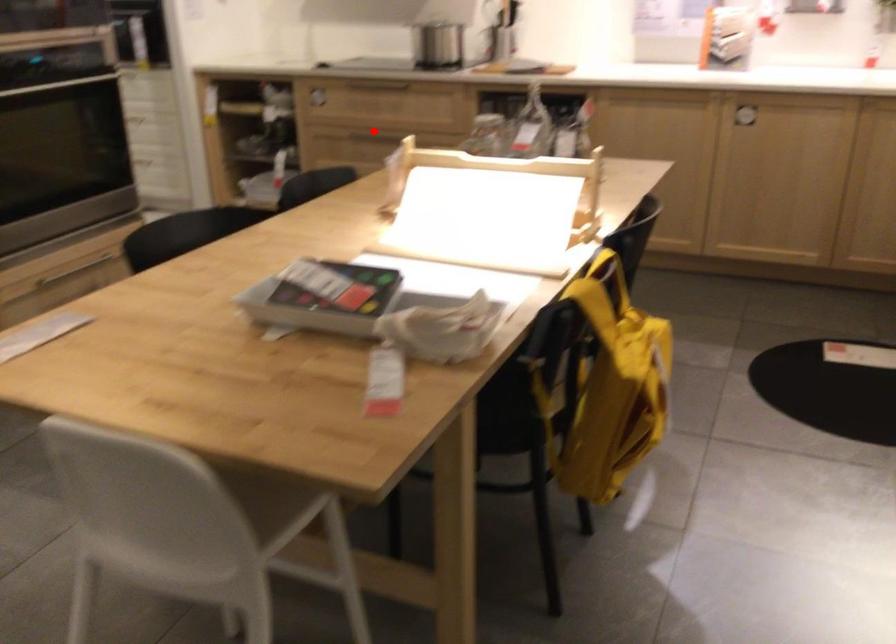
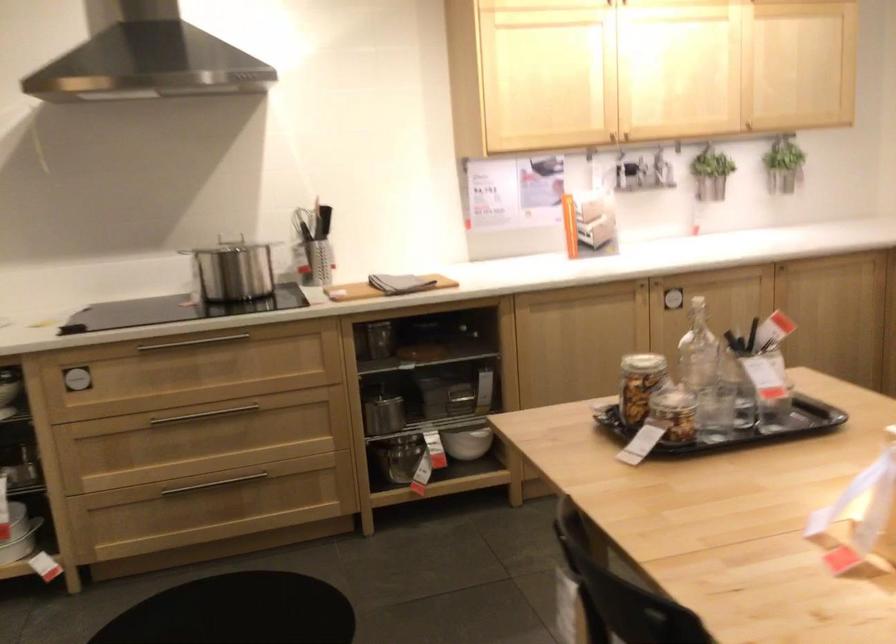
Locate, in the second image, the point that corresponds to the highlighted location in the first image.

(200, 415)